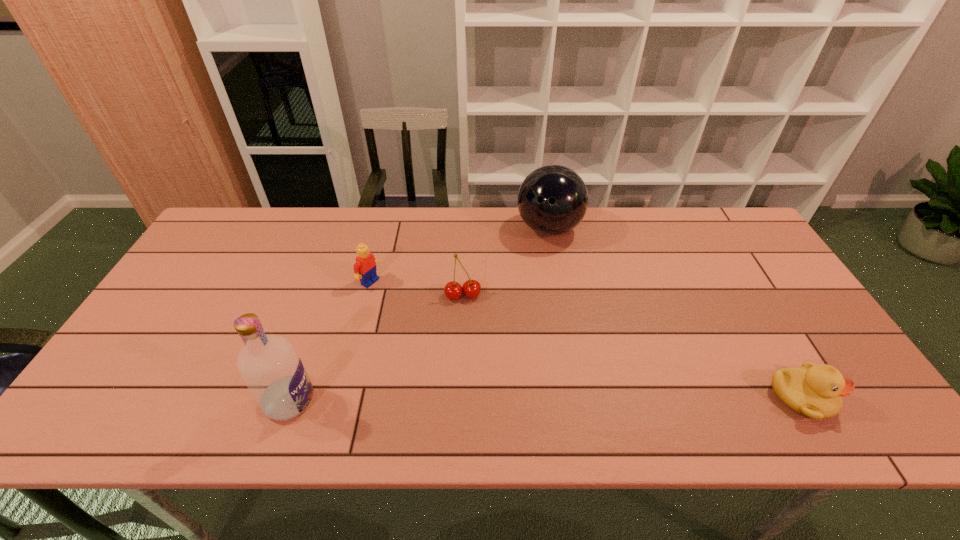
Where is `duckling located in the near edge section of the desktop`? duckling located in the near edge section of the desktop is located at coordinates (815, 391).

This screenshot has width=960, height=540. Identify the location of object located at the right edge. (815, 391).

This screenshot has width=960, height=540. I want to click on object situated at the near right corner, so click(x=815, y=391).

At what (x,y) coordinates should I click in order to perform the action: click on vacant space at the far edge. Please return your answer as a coordinate pair (x, y). Looking at the image, I should click on (372, 252).

The image size is (960, 540). In the image, there is a desktop. What are the coordinates of `vacant space at the near edge` in the screenshot? It's located at (751, 390).

You are a GUI agent. You are given a task and a screenshot of the screen. Output one action in this format:
    pyautogui.click(x=<x>, y=<y>)
    Task: Click on the vacant point at the far right corner
    This screenshot has width=960, height=540.
    Given the screenshot: What is the action you would take?
    pyautogui.click(x=695, y=207)

This screenshot has height=540, width=960. I want to click on blank region between the third object from left to right and the bowling ball, so click(x=506, y=262).

Where is `vacant space that is in between the second object from right to left and the tallest object`? Image resolution: width=960 pixels, height=540 pixels. vacant space that is in between the second object from right to left and the tallest object is located at coordinates (420, 315).

Where is `empty location between the duckling and the cherry`? The width and height of the screenshot is (960, 540). empty location between the duckling and the cherry is located at coordinates (632, 347).

You are a GUI agent. You are given a task and a screenshot of the screen. Output one action in this format:
    pyautogui.click(x=<x>, y=<y>)
    Task: Click on the vacant area that lies between the fourth shortest object and the tallest object
    This screenshot has height=540, width=960.
    Given the screenshot: What is the action you would take?
    pyautogui.click(x=420, y=315)